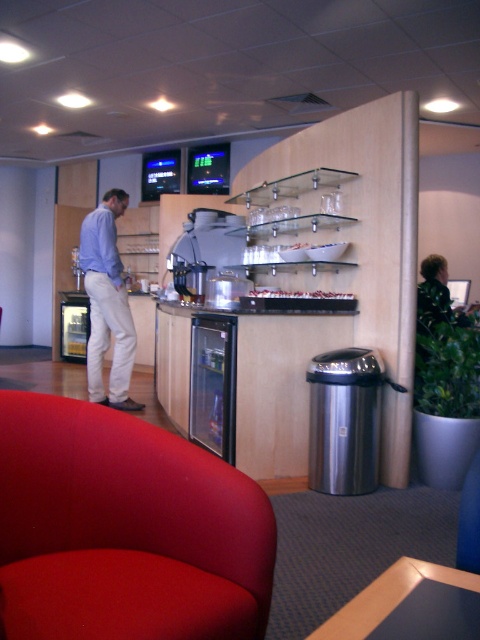
You are a barista standing at the espresso machine in the midground. You need to deliver a coffee to the person wearing the matte blue shirt at center who is sitting in the velvet red armchair at lower left. Can you reach them without moving from your position?

The distance between the velvet red armchair at lower left and the matte blue shirt at center is 3.11 meters. Since you are at the espresso machine in the midground, you would need to move towards them to deliver the coffee, as the distance is too far to reach without moving.

You are standing in the office break area and want to place a new coffee machine. There are two points marked as point 1 at coordinate [96,570] and point 2 at coordinate [96,355]. Which point is better for placing the machine if you want it closer to you when standing at the entrance?

Point 1 at coordinate [96,570] is closer to the viewer than point 2 at coordinate [96,355], so placing the coffee machine there would be better if you want it closer to you when standing at the entrance.